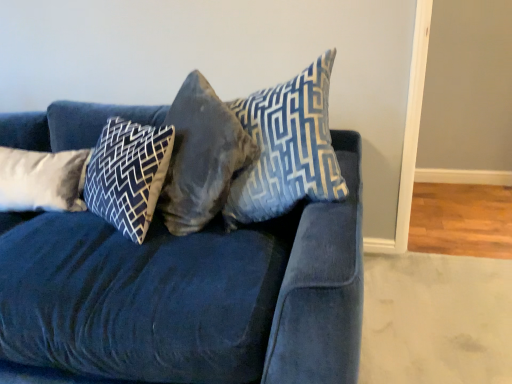
This screenshot has width=512, height=384. Identify the location of velvet gray pillow at center, positioned as the 3th pillow in left-to-right order. (201, 156).

The image size is (512, 384). Identify the location of blue velvet pillow at center, which is counted as the fourth pillow, starting from the left. (287, 148).

Describe the element at coordinates (42, 180) in the screenshot. I see `white soft pillow at left, arranged as the first pillow when viewed from the left` at that location.

Where is `white soft pillow at left, arranged as the first pillow when viewed from the left`? The width and height of the screenshot is (512, 384). white soft pillow at left, arranged as the first pillow when viewed from the left is located at coordinates (42, 180).

The image size is (512, 384). In order to click on dark blue velvet pillow at center, which ranks as the 3th pillow in right-to-left order in this screenshot , I will do `click(128, 174)`.

Measure the distance between velvet gray pillow at center, positioned as the second pillow in right-to-left order, and white soft pillow at left, the 4th pillow positioned from the right.

The distance of velvet gray pillow at center, positioned as the second pillow in right-to-left order, from white soft pillow at left, the 4th pillow positioned from the right, is 55.10 centimeters.

Would you say velvet gray pillow at center, positioned as the second pillow in right-to-left order, is inside or outside white soft pillow at left, the 4th pillow positioned from the right?

velvet gray pillow at center, positioned as the second pillow in right-to-left order, cannot be found inside white soft pillow at left, the 4th pillow positioned from the right.

Which of these two, velvet gray pillow at center, positioned as the 3th pillow in left-to-right order, or white soft pillow at left, the 4th pillow positioned from the right, is thinner?

Thinner between the two is white soft pillow at left, the 4th pillow positioned from the right.

Is the depth of velvet gray pillow at center, positioned as the 3th pillow in left-to-right order, greater than that of white soft pillow at left, arranged as the first pillow when viewed from the left?

No, it is not.

Is dark blue velvet pillow at center, which ranks as the 3th pillow in right-to-left order, surrounding velvet gray pillow at center, positioned as the 3th pillow in left-to-right order?

No, velvet gray pillow at center, positioned as the 3th pillow in left-to-right order, is not a part of dark blue velvet pillow at center, which ranks as the 3th pillow in right-to-left order.

Is dark blue velvet pillow at center, the 2th pillow when ordered from left to right, oriented away from velvet gray pillow at center, positioned as the 3th pillow in left-to-right order?

No, velvet gray pillow at center, positioned as the 3th pillow in left-to-right order, is not at the back of dark blue velvet pillow at center, the 2th pillow when ordered from left to right.

How different are the orientations of dark blue velvet pillow at center, the 2th pillow when ordered from left to right, and velvet gray pillow at center, positioned as the 3th pillow in left-to-right order, in degrees?

dark blue velvet pillow at center, the 2th pillow when ordered from left to right, and velvet gray pillow at center, positioned as the 3th pillow in left-to-right order, are facing 0.000639 degrees away from each other.

Considering the points (156, 138) and (226, 190), which point is behind, point (156, 138) or point (226, 190)?

The point (156, 138) is farther from the camera.

Which is more to the left, velvet blue couch at center or dark blue velvet pillow at center, the 2th pillow when ordered from left to right?

From the viewer's perspective, velvet blue couch at center appears more on the left side.

Can you confirm if velvet blue couch at center is wider than dark blue velvet pillow at center, the 2th pillow when ordered from left to right?

Correct, the width of velvet blue couch at center exceeds that of dark blue velvet pillow at center, the 2th pillow when ordered from left to right.

This screenshot has height=384, width=512. In order to click on pillow that is the 1st object to the right of the velvet blue couch at center, starting at the anchor in this screenshot , I will do `click(128, 174)`.

Would you say dark blue velvet pillow at center, the 2th pillow when ordered from left to right, is part of velvet blue couch at center's contents?

Absolutely, dark blue velvet pillow at center, the 2th pillow when ordered from left to right, is inside velvet blue couch at center.

In the scene shown: Is blue velvet pillow at center, which is counted as the fourth pillow, starting from the left, inside the boundaries of dark blue velvet pillow at center, the 2th pillow when ordered from left to right, or outside?

blue velvet pillow at center, which is counted as the fourth pillow, starting from the left, lies outside dark blue velvet pillow at center, the 2th pillow when ordered from left to right.

Is blue velvet pillow at center, the 1th pillow positioned from the right, not close to dark blue velvet pillow at center, the 2th pillow when ordered from left to right?

No, blue velvet pillow at center, the 1th pillow positioned from the right, is not far away from dark blue velvet pillow at center, the 2th pillow when ordered from left to right.

Can you confirm if blue velvet pillow at center, which is counted as the fourth pillow, starting from the left, is smaller than dark blue velvet pillow at center, the 2th pillow when ordered from left to right?

Incorrect, blue velvet pillow at center, which is counted as the fourth pillow, starting from the left, is not smaller in size than dark blue velvet pillow at center, the 2th pillow when ordered from left to right.

Is blue velvet pillow at center, which is counted as the fourth pillow, starting from the left, positioned with its back to dark blue velvet pillow at center, which ranks as the 3th pillow in right-to-left order?

No, blue velvet pillow at center, which is counted as the fourth pillow, starting from the left, is not facing away from dark blue velvet pillow at center, which ranks as the 3th pillow in right-to-left order.

I want to click on the 3rd pillow behind the blue velvet pillow at center, which is counted as the fourth pillow, starting from the left, so click(42, 180).

Considering the relative positions of white soft pillow at left, the 4th pillow positioned from the right, and blue velvet pillow at center, which is counted as the fourth pillow, starting from the left, in the image provided, is white soft pillow at left, the 4th pillow positioned from the right, behind blue velvet pillow at center, which is counted as the fourth pillow, starting from the left,?

Yes, it is behind blue velvet pillow at center, which is counted as the fourth pillow, starting from the left.

Is white soft pillow at left, the 4th pillow positioned from the right, located outside blue velvet pillow at center, which is counted as the fourth pillow, starting from the left?

Yes, white soft pillow at left, the 4th pillow positioned from the right, is outside of blue velvet pillow at center, which is counted as the fourth pillow, starting from the left.

Considering the positions of objects white soft pillow at left, the 4th pillow positioned from the right, and blue velvet pillow at center, which is counted as the fourth pillow, starting from the left, in the image provided, who is more to the left, white soft pillow at left, the 4th pillow positioned from the right, or blue velvet pillow at center, which is counted as the fourth pillow, starting from the left,?

white soft pillow at left, the 4th pillow positioned from the right.

Which object is positioned more to the left, velvet blue couch at center or white soft pillow at left, the 4th pillow positioned from the right?

white soft pillow at left, the 4th pillow positioned from the right.

How many degrees apart are the facing directions of velvet blue couch at center and white soft pillow at left, arranged as the first pillow when viewed from the left?

The facing directions of velvet blue couch at center and white soft pillow at left, arranged as the first pillow when viewed from the left, are 0.734 degrees apart.

From the image's perspective, would you say velvet blue couch at center is positioned over white soft pillow at left, arranged as the first pillow when viewed from the left?

Actually, velvet blue couch at center appears below white soft pillow at left, arranged as the first pillow when viewed from the left, in the image.

Does velvet blue couch at center come in front of white soft pillow at left, the 4th pillow positioned from the right?

Yes, it is.

Is white soft pillow at left, arranged as the first pillow when viewed from the left, not inside velvet gray pillow at center, positioned as the second pillow in right-to-left order?

Indeed, white soft pillow at left, arranged as the first pillow when viewed from the left, is completely outside velvet gray pillow at center, positioned as the second pillow in right-to-left order.

Is white soft pillow at left, the 4th pillow positioned from the right, oriented away from velvet gray pillow at center, positioned as the 3th pillow in left-to-right order?

No, velvet gray pillow at center, positioned as the 3th pillow in left-to-right order, is not at the back of white soft pillow at left, the 4th pillow positioned from the right.

From the image's perspective, which is below, white soft pillow at left, arranged as the first pillow when viewed from the left, or velvet gray pillow at center, positioned as the 3th pillow in left-to-right order?

white soft pillow at left, arranged as the first pillow when viewed from the left, is shown below in the image.

From a real-world perspective, which is physically below, white soft pillow at left, the 4th pillow positioned from the right, or velvet gray pillow at center, positioned as the second pillow in right-to-left order?

white soft pillow at left, the 4th pillow positioned from the right, from a real-world perspective.

Find the location of `pillow that is the 2nd object to the right of the white soft pillow at left, the 4th pillow positioned from the right, starting at the anchor`. pillow that is the 2nd object to the right of the white soft pillow at left, the 4th pillow positioned from the right, starting at the anchor is located at coordinates (201, 156).

There is a dark blue velvet pillow at center, the 2th pillow when ordered from left to right. Where is `the 1st pillow above it (from a real-world perspective)`? The width and height of the screenshot is (512, 384). the 1st pillow above it (from a real-world perspective) is located at coordinates (201, 156).

Consider the image. From the image, which object appears to be farther from dark blue velvet pillow at center, which ranks as the 3th pillow in right-to-left order, velvet blue couch at center or blue velvet pillow at center, the 1th pillow positioned from the right?

blue velvet pillow at center, the 1th pillow positioned from the right, lies further to dark blue velvet pillow at center, which ranks as the 3th pillow in right-to-left order, than the other object.

Looking at the image, which one is located further to white soft pillow at left, arranged as the first pillow when viewed from the left, velvet blue couch at center or velvet gray pillow at center, positioned as the second pillow in right-to-left order?

The object further to white soft pillow at left, arranged as the first pillow when viewed from the left, is velvet gray pillow at center, positioned as the second pillow in right-to-left order.

When comparing their distances from velvet gray pillow at center, positioned as the second pillow in right-to-left order, does blue velvet pillow at center, the 1th pillow positioned from the right, or dark blue velvet pillow at center, which ranks as the 3th pillow in right-to-left order, seem closer?

Based on the image, blue velvet pillow at center, the 1th pillow positioned from the right, appears to be nearer to velvet gray pillow at center, positioned as the second pillow in right-to-left order.

When comparing their distances from velvet blue couch at center, does dark blue velvet pillow at center, which ranks as the 3th pillow in right-to-left order, or blue velvet pillow at center, the 1th pillow positioned from the right, seem further?

blue velvet pillow at center, the 1th pillow positioned from the right.

From the image, which object appears to be nearer to velvet blue couch at center, dark blue velvet pillow at center, which ranks as the 3th pillow in right-to-left order, or white soft pillow at left, arranged as the first pillow when viewed from the left?

The object closer to velvet blue couch at center is dark blue velvet pillow at center, which ranks as the 3th pillow in right-to-left order.

Based on their spatial positions, is dark blue velvet pillow at center, which ranks as the 3th pillow in right-to-left order, or velvet gray pillow at center, positioned as the second pillow in right-to-left order, closer to blue velvet pillow at center, the 1th pillow positioned from the right?

velvet gray pillow at center, positioned as the second pillow in right-to-left order.

Considering their positions, is white soft pillow at left, arranged as the first pillow when viewed from the left, positioned further to blue velvet pillow at center, the 1th pillow positioned from the right, than velvet gray pillow at center, positioned as the 3th pillow in left-to-right order?

The object further to blue velvet pillow at center, the 1th pillow positioned from the right, is white soft pillow at left, arranged as the first pillow when viewed from the left.

From the picture: Which object lies further to the anchor point white soft pillow at left, the 4th pillow positioned from the right, blue velvet pillow at center, which is counted as the fourth pillow, starting from the left, or velvet gray pillow at center, positioned as the 3th pillow in left-to-right order?

Among the two, blue velvet pillow at center, which is counted as the fourth pillow, starting from the left, is located further to white soft pillow at left, the 4th pillow positioned from the right.

I want to click on studio couch located between white soft pillow at left, arranged as the first pillow when viewed from the left, and blue velvet pillow at center, the 1th pillow positioned from the right, in the left-right direction, so click(190, 295).

Identify the location of pillow between white soft pillow at left, arranged as the first pillow when viewed from the left, and velvet gray pillow at center, positioned as the second pillow in right-to-left order, from left to right. The height and width of the screenshot is (384, 512). (128, 174).

Where is `pillow between dark blue velvet pillow at center, the 2th pillow when ordered from left to right, and blue velvet pillow at center, the 1th pillow positioned from the right, in the horizontal direction`? The height and width of the screenshot is (384, 512). pillow between dark blue velvet pillow at center, the 2th pillow when ordered from left to right, and blue velvet pillow at center, the 1th pillow positioned from the right, in the horizontal direction is located at coordinates (201, 156).